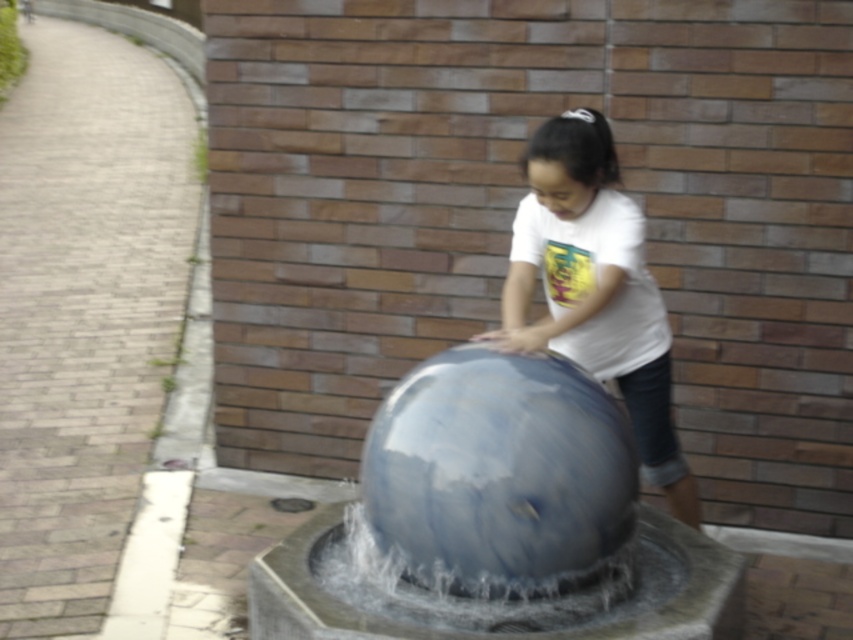
Is shiny metallic sphere at center smaller than transparent glass water at center?

Actually, shiny metallic sphere at center might be larger than transparent glass water at center.

Which is in front, point (552, 380) or point (554, 378)?

Point (552, 380)

At what (x,y) coordinates should I click in order to perform the action: click on shiny metallic sphere at center. Please return your answer as a coordinate pair (x, y). Looking at the image, I should click on (502, 516).

This screenshot has width=853, height=640. Describe the element at coordinates (498, 474) in the screenshot. I see `transparent glass water at center` at that location.

Can you confirm if transparent glass water at center is positioned below white glossy shirt at upper center?

Indeed, transparent glass water at center is positioned under white glossy shirt at upper center.

The height and width of the screenshot is (640, 853). I want to click on transparent glass water at center, so click(498, 474).

This screenshot has height=640, width=853. I want to click on transparent glass water at center, so click(498, 474).

Does shiny metallic sphere at center have a larger size compared to white glossy shirt at upper center?

Yes.

In the scene shown: Can you confirm if shiny metallic sphere at center is shorter than white glossy shirt at upper center?

Correct, shiny metallic sphere at center is not as tall as white glossy shirt at upper center.

Describe the element at coordinates (502, 516) in the screenshot. The image size is (853, 640). I see `shiny metallic sphere at center` at that location.

Identify the location of shiny metallic sphere at center. The image size is (853, 640). (502, 516).